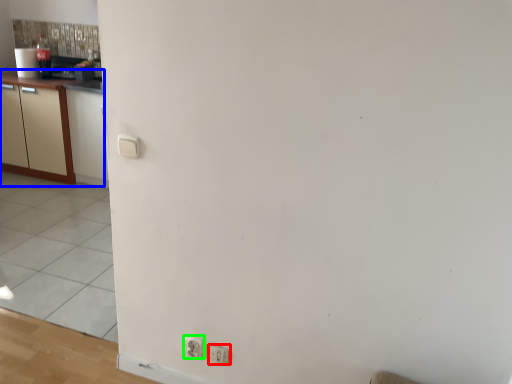
Question: Considering the real-world distances, which object is closest to electric outlet (highlighted by a red box)? cabinetry (highlighted by a blue box) or electric outlet (highlighted by a green box).

Choices:
 (A) cabinetry
 (B) electric outlet

Answer: (B)